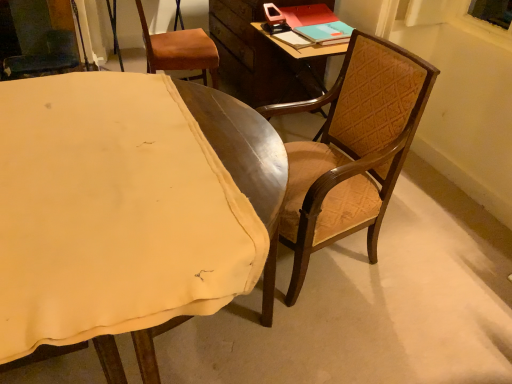
Question: Is brown leather chair at upper left, positioned as the 3th chair in front-to-back order, to the left of teal matte book at upper right from the viewer's perspective?

Choices:
 (A) no
 (B) yes

Answer: (B)

Question: Can you confirm if brown leather chair at upper left, positioned as the 3th chair in front-to-back order, is taller than teal matte book at upper right?

Choices:
 (A) no
 (B) yes

Answer: (B)

Question: Is brown leather chair at upper left, positioned as the first chair in back-to-front order, facing away from teal matte book at upper right?

Choices:
 (A) no
 (B) yes

Answer: (A)

Question: Does brown leather chair at upper left, positioned as the first chair in back-to-front order, have a lesser width compared to teal matte book at upper right?

Choices:
 (A) no
 (B) yes

Answer: (A)

Question: Can teal matte book at upper right be found inside brown leather chair at upper left, positioned as the 3th chair in front-to-back order?

Choices:
 (A) yes
 (B) no

Answer: (B)

Question: Considering the relative sizes of brown leather chair at upper left, positioned as the 3th chair in front-to-back order, and teal matte book at upper right in the image provided, is brown leather chair at upper left, positioned as the 3th chair in front-to-back order, bigger than teal matte book at upper right?

Choices:
 (A) yes
 (B) no

Answer: (A)

Question: From a real-world perspective, is teal matte book at upper right located beneath wooden chair at right, which is the third chair from back to front?

Choices:
 (A) no
 (B) yes

Answer: (A)

Question: Considering the relative sizes of teal matte book at upper right and wooden chair at right, which is the third chair from back to front, in the image provided, is teal matte book at upper right smaller than wooden chair at right, which is the third chair from back to front,?

Choices:
 (A) yes
 (B) no

Answer: (A)

Question: Is the depth of teal matte book at upper right less than that of wooden chair at right, which is the third chair from back to front?

Choices:
 (A) yes
 (B) no

Answer: (B)

Question: Is teal matte book at upper right facing towards wooden chair at right, the first chair positioned from the front?

Choices:
 (A) no
 (B) yes

Answer: (A)

Question: Does teal matte book at upper right have a lesser width compared to wooden chair at right, which is the third chair from back to front?

Choices:
 (A) yes
 (B) no

Answer: (A)

Question: Is teal matte book at upper right to the left of wooden chair at right, the first chair positioned from the front, from the viewer's perspective?

Choices:
 (A) yes
 (B) no

Answer: (B)

Question: Is wooden chair at center, which is counted as the 2th chair, starting from the back, outside of teal matte book at upper right?

Choices:
 (A) yes
 (B) no

Answer: (A)